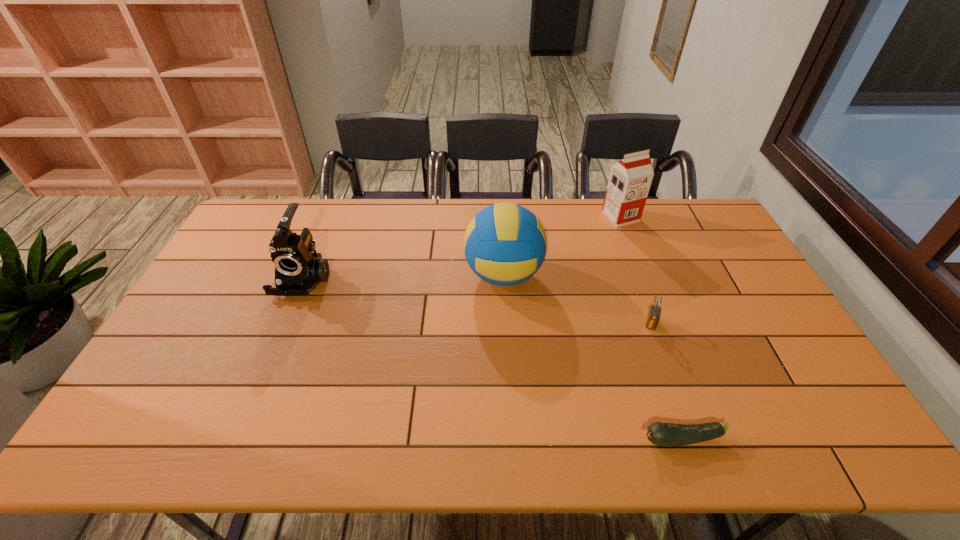
Find the location of a particular element. This screenshot has height=540, width=960. vacant space at the far left corner of the desktop is located at coordinates (285, 207).

Image resolution: width=960 pixels, height=540 pixels. Identify the location of vacant space at the far right corner. (715, 218).

Locate an element on the screen. free space between the zucchini and the leftmost object is located at coordinates (492, 359).

Find the location of a particular element. free space that is in between the padlock and the nearest object is located at coordinates (666, 381).

At what (x,y) coordinates should I click in order to perform the action: click on free space between the leftmost object and the fourth tallest object. Please return your answer as a coordinate pair (x, y). The image size is (960, 540). Looking at the image, I should click on click(x=477, y=301).

Where is `vacant space in between the zucchini and the fourth farthest object`? The width and height of the screenshot is (960, 540). vacant space in between the zucchini and the fourth farthest object is located at coordinates (666, 381).

Where is `free area in between the soya milk and the second object from left to right`? This screenshot has height=540, width=960. free area in between the soya milk and the second object from left to right is located at coordinates (x=562, y=246).

The image size is (960, 540). Identify the location of unoccupied position between the fourth farthest object and the camcorder. (477, 301).

This screenshot has width=960, height=540. In order to click on blank region between the volleyball and the second nearest object in this screenshot , I will do `click(577, 299)`.

At what (x,y) coordinates should I click in order to perform the action: click on empty space between the shortest object and the second object from left to right. Please return your answer as a coordinate pair (x, y). The width and height of the screenshot is (960, 540). Looking at the image, I should click on (592, 357).